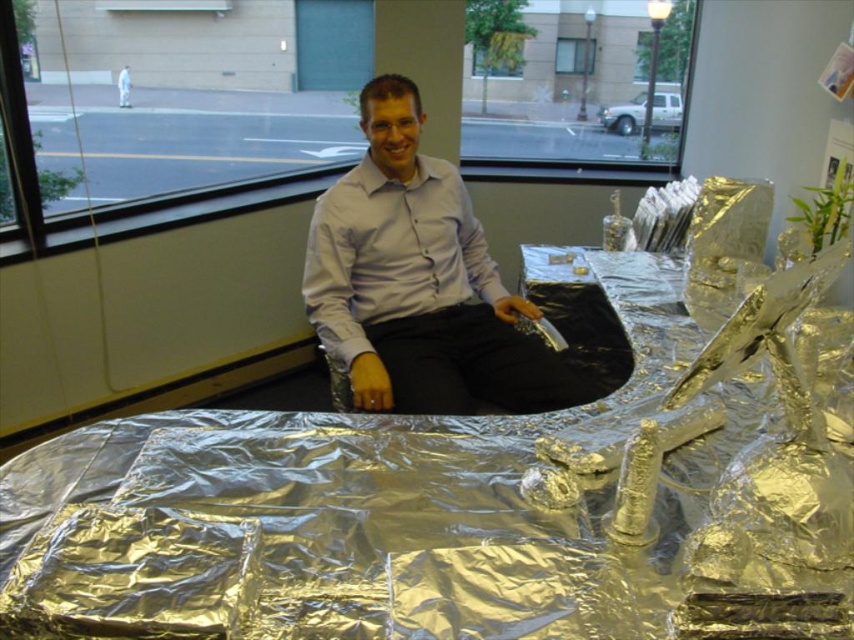
Question: Is the position of silver reflective table at center more distant than that of matte white shirt at center?

Choices:
 (A) yes
 (B) no

Answer: (B)

Question: Which point is closer to the camera?

Choices:
 (A) silver reflective table at center
 (B) matte white shirt at center

Answer: (A)

Question: In this image, where is silver reflective table at center located relative to matte white shirt at center?

Choices:
 (A) right
 (B) left

Answer: (A)

Question: Can you confirm if silver reflective table at center is smaller than matte white shirt at center?

Choices:
 (A) yes
 (B) no

Answer: (B)

Question: Which point appears closest to the camera in this image?

Choices:
 (A) pos(355,384)
 (B) pos(361,618)

Answer: (B)